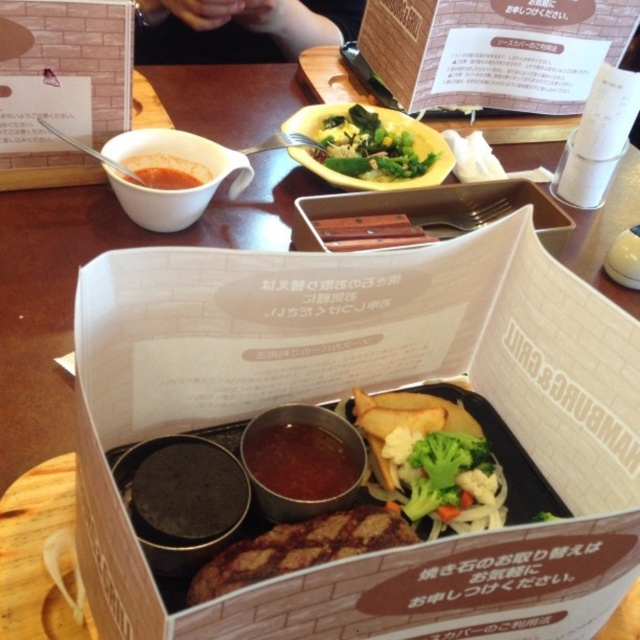
You are a customer at this restaurant and want to reach both the white cardboard box at upper center and the thick brown sauce at center. Based on their positions, which one do you need to move first to access the other?

The white cardboard box at upper center is to the right of thick brown sauce at center. To access the thick brown sauce at center, you would need to move the white cardboard box at upper center first since it is blocking the path to the sauce.

You are a food delivery person who needs to pack the matte white bowl at upper left and the green leafy vegetables at center into a small container. Which item should you place first to ensure both fit?

The green leafy vegetables at center are smaller than the matte white bowl at upper left. To fit both items, place the larger matte white bowl at upper left first, then the smaller green leafy vegetables at center on top or beside it.